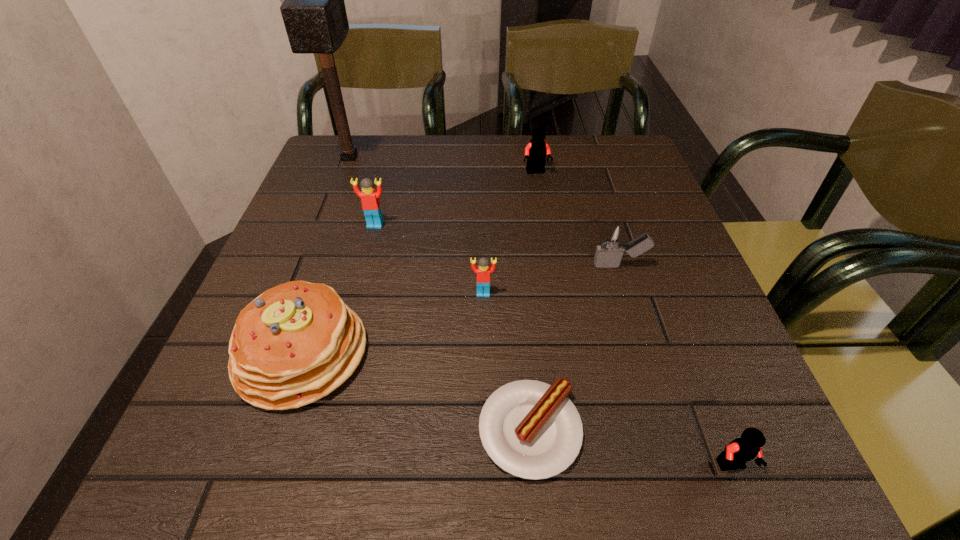
Locate an element on the screen. vacant space at the far edge of the desktop is located at coordinates (487, 145).

Where is `vacant area at the near edge of the desktop`? vacant area at the near edge of the desktop is located at coordinates (421, 474).

You are a GUI agent. You are given a task and a screenshot of the screen. Output one action in this format:
    pyautogui.click(x=<x>, y=<y>)
    Task: Click on the vacant space at the left edge of the desktop
    The width and height of the screenshot is (960, 540).
    Given the screenshot: What is the action you would take?
    pyautogui.click(x=330, y=233)

This screenshot has width=960, height=540. In the image, there is a desktop. Identify the location of vacant region at the right edge. (742, 385).

The image size is (960, 540). What are the coordinates of `vacant position at the far right corner of the desktop` in the screenshot? It's located at (633, 147).

The image size is (960, 540). Identify the location of free point between the farthest Lego and the rightmost Lego. coord(634,319).

Find the location of a particular element. This screenshot has width=960, height=540. vacant area between the tallest object and the sausage is located at coordinates (440, 294).

Identify the location of vacant area that lies between the second Lego from left to right and the left red Lego. (429, 259).

Image resolution: width=960 pixels, height=540 pixels. In order to click on vacant space in between the igniter and the second nearest Lego in this screenshot , I will do `click(551, 279)`.

Locate an element on the screen. free point between the tallest object and the nearer black Lego is located at coordinates (540, 312).